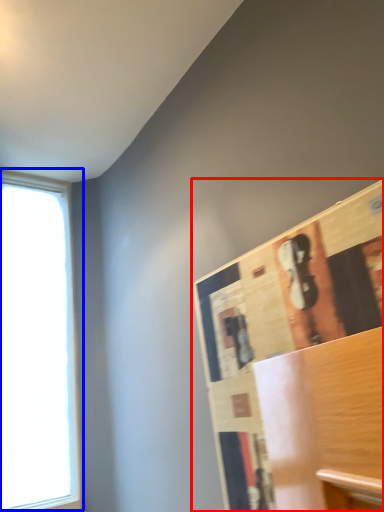
Question: Which object appears farthest to the camera in this image, bulletin board (highlighted by a red box) or window (highlighted by a blue box)?

Choices:
 (A) bulletin board
 (B) window

Answer: (B)